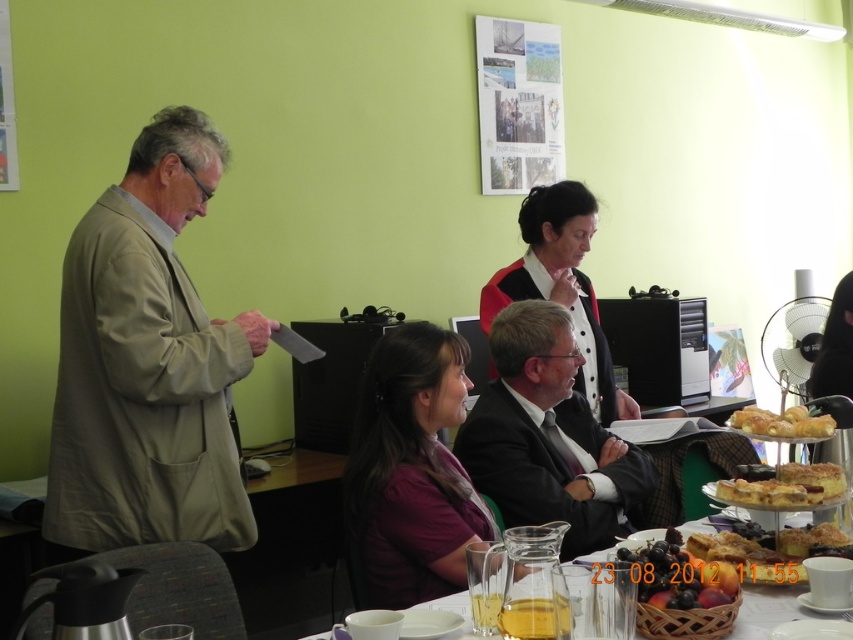
Can you confirm if khaki fabric jacket at left is positioned to the right of purple satin blouse at center?

No, khaki fabric jacket at left is not to the right of purple satin blouse at center.

Is point (77, 497) behind point (427, 595)?

Yes, point (77, 497) is behind point (427, 595).

Does point (201, 508) come behind point (386, 566)?

Yes, point (201, 508) is behind point (386, 566).

Where is `khaki fabric jacket at left`? Image resolution: width=853 pixels, height=640 pixels. khaki fabric jacket at left is located at coordinates (148, 364).

Is purple satin blouse at center taller than dark suit at center?

Correct, purple satin blouse at center is much taller as dark suit at center.

Is purple satin blouse at center closer to camera compared to dark suit at center?

Yes, it is in front of dark suit at center.

Which is behind, point (459, 512) or point (508, 506)?

The point (508, 506) is behind.

Image resolution: width=853 pixels, height=640 pixels. Find the location of `purple satin blouse at center`. purple satin blouse at center is located at coordinates (410, 472).

Is khaki fabric jacket at left in front of dark suit at center?

Yes, khaki fabric jacket at left is closer to the viewer.

Who is more distant from viewer, (80,256) or (492,490)?

The point (492,490) is behind.

You are a GUI agent. You are given a task and a screenshot of the screen. Output one action in this format:
    pyautogui.click(x=<x>, y=<y>)
    Task: Click on the khaki fabric jacket at left
    
    Given the screenshot: What is the action you would take?
    pyautogui.click(x=148, y=364)